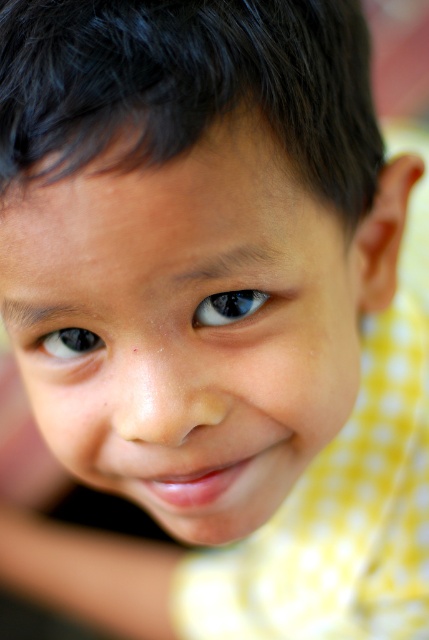
Question: Does smooth skin face at center have a larger size compared to black glossy eye at center?

Choices:
 (A) no
 (B) yes

Answer: (B)

Question: Which object is the closest to the blue glossy eye at center?

Choices:
 (A) smooth skin face at center
 (B) black glossy eye at center

Answer: (B)

Question: Does blue glossy eye at center appear on the right side of black glossy eye at center?

Choices:
 (A) no
 (B) yes

Answer: (B)

Question: Which point appears closest to the camera in this image?

Choices:
 (A) (18, 364)
 (B) (211, 314)
 (C) (76, 355)

Answer: (B)

Question: Which of the following is the closest to the observer?

Choices:
 (A) (233, 308)
 (B) (181, 451)
 (C) (68, 333)

Answer: (A)

Question: Is blue glossy eye at center closer to the viewer compared to black glossy eye at center?

Choices:
 (A) yes
 (B) no

Answer: (A)